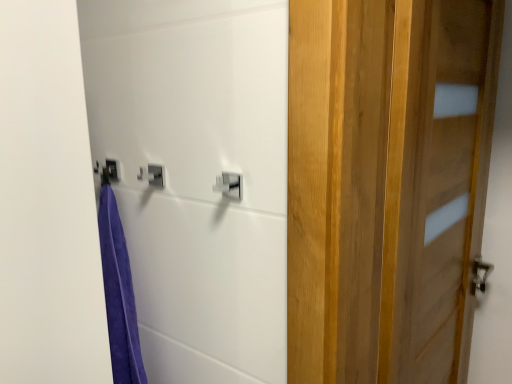
What do you see at coordinates (386, 185) in the screenshot?
I see `wooden door at right` at bounding box center [386, 185].

This screenshot has width=512, height=384. What are the coordinates of `wooden door at right` in the screenshot? It's located at (386, 185).

This screenshot has height=384, width=512. What do you see at coordinates (229, 185) in the screenshot?
I see `silver metallic lock at center` at bounding box center [229, 185].

Where is `silver metallic lock at center`? The width and height of the screenshot is (512, 384). silver metallic lock at center is located at coordinates (229, 185).

Identify the location of wooden door at right. This screenshot has height=384, width=512. (386, 185).

Is silver metallic lock at center to the left or to the right of wooden door at right in the image?

From the image, it's evident that silver metallic lock at center is to the left of wooden door at right.

Consider the image. Which object is closer to the camera taking this photo, silver metallic lock at center or wooden door at right?

wooden door at right is in front.

Is point (234, 180) positioned before point (499, 34)?

Yes, it is.

From the image's perspective, is silver metallic lock at center above wooden door at right?

Indeed, from the image's perspective, silver metallic lock at center is shown above wooden door at right.

From a real-world perspective, is silver metallic lock at center on wooden door at right?

Yes, from a real-world perspective, silver metallic lock at center is above wooden door at right.

Which object is wider, silver metallic lock at center or wooden door at right?

With larger width is wooden door at right.

Who is shorter, silver metallic lock at center or wooden door at right?

Standing shorter between the two is silver metallic lock at center.

In terms of size, does silver metallic lock at center appear bigger or smaller than wooden door at right?

silver metallic lock at center is smaller than wooden door at right.

Is silver metallic lock at center situated inside wooden door at right or outside?

silver metallic lock at center is not inside wooden door at right, it's outside.

Are silver metallic lock at center and wooden door at right located far from each other?

No.

Is silver metallic lock at center oriented away from wooden door at right?

Yes, silver metallic lock at center's orientation is away from wooden door at right.

I want to click on lock located above the wooden door at right (from a real-world perspective), so click(229, 185).

Is wooden door at right to the left of silver metallic lock at center from the viewer's perspective?

Incorrect, wooden door at right is not on the left side of silver metallic lock at center.

Considering the relative positions of wooden door at right and silver metallic lock at center in the image provided, is wooden door at right in front of silver metallic lock at center?

That is True.

Does point (384, 333) lie in front of point (220, 182)?

That is False.

From the image's perspective, does wooden door at right appear lower than silver metallic lock at center?

Correct, wooden door at right appears lower than silver metallic lock at center in the image.

From a real-world perspective, which object rests below the other?

wooden door at right, from a real-world perspective.

Which of these two, wooden door at right or silver metallic lock at center, is wider?

wooden door at right.

In terms of height, does wooden door at right look taller or shorter compared to silver metallic lock at center?

wooden door at right is taller than silver metallic lock at center.

Between wooden door at right and silver metallic lock at center, which one has smaller size?

silver metallic lock at center is smaller.

Is wooden door at right spatially inside silver metallic lock at center, or outside of it?

wooden door at right is located beyond the bounds of silver metallic lock at center.

Can you see wooden door at right touching silver metallic lock at center?

No, wooden door at right is not in contact with silver metallic lock at center.

Is wooden door at right oriented towards silver metallic lock at center?

No, wooden door at right does not turn towards silver metallic lock at center.

In the scene shown: How many degrees apart are the facing directions of wooden door at right and silver metallic lock at center?

There is a 90.9-degree angle between the facing directions of wooden door at right and silver metallic lock at center.

Where is `lock behind the wooden door at right`? lock behind the wooden door at right is located at coordinates (229, 185).

Locate an element on the screen. door below the silver metallic lock at center (from a real-world perspective) is located at coordinates (386, 185).

Locate an element on the screen. lock that appears on the left of wooden door at right is located at coordinates (229, 185).